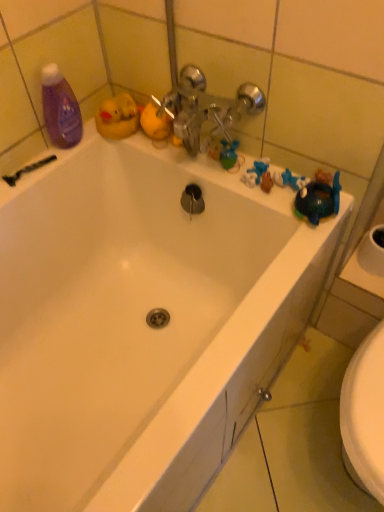
Question: From the image's perspective, is black plastic razor at upper left over purple glossy bottle at upper left?

Choices:
 (A) no
 (B) yes

Answer: (A)

Question: Is the depth of black plastic razor at upper left greater than that of purple glossy bottle at upper left?

Choices:
 (A) no
 (B) yes

Answer: (B)

Question: From the image's perspective, is black plastic razor at upper left under purple glossy bottle at upper left?

Choices:
 (A) no
 (B) yes

Answer: (B)

Question: Is black plastic razor at upper left touching purple glossy bottle at upper left?

Choices:
 (A) no
 (B) yes

Answer: (A)

Question: Does black plastic razor at upper left have a larger size compared to purple glossy bottle at upper left?

Choices:
 (A) yes
 (B) no

Answer: (B)

Question: Does black plastic razor at upper left have a lesser height compared to purple glossy bottle at upper left?

Choices:
 (A) no
 (B) yes

Answer: (B)

Question: From the image's perspective, is purple glossy bottle at upper left on black plastic razor at upper left?

Choices:
 (A) yes
 (B) no

Answer: (A)

Question: Is purple glossy bottle at upper left positioned in front of black plastic razor at upper left?

Choices:
 (A) yes
 (B) no

Answer: (A)

Question: Can you confirm if purple glossy bottle at upper left is wider than black plastic razor at upper left?

Choices:
 (A) yes
 (B) no

Answer: (A)

Question: Does purple glossy bottle at upper left have a lesser width compared to black plastic razor at upper left?

Choices:
 (A) no
 (B) yes

Answer: (A)

Question: Would you say purple glossy bottle at upper left is a long distance from black plastic razor at upper left?

Choices:
 (A) yes
 (B) no

Answer: (B)

Question: Considering the relative sizes of purple glossy bottle at upper left and black plastic razor at upper left in the image provided, is purple glossy bottle at upper left taller than black plastic razor at upper left?

Choices:
 (A) no
 (B) yes

Answer: (B)

Question: Considering the positions of purple glossy bottle at upper left and black plastic razor at upper left in the image, is purple glossy bottle at upper left taller or shorter than black plastic razor at upper left?

Choices:
 (A) short
 (B) tall

Answer: (B)